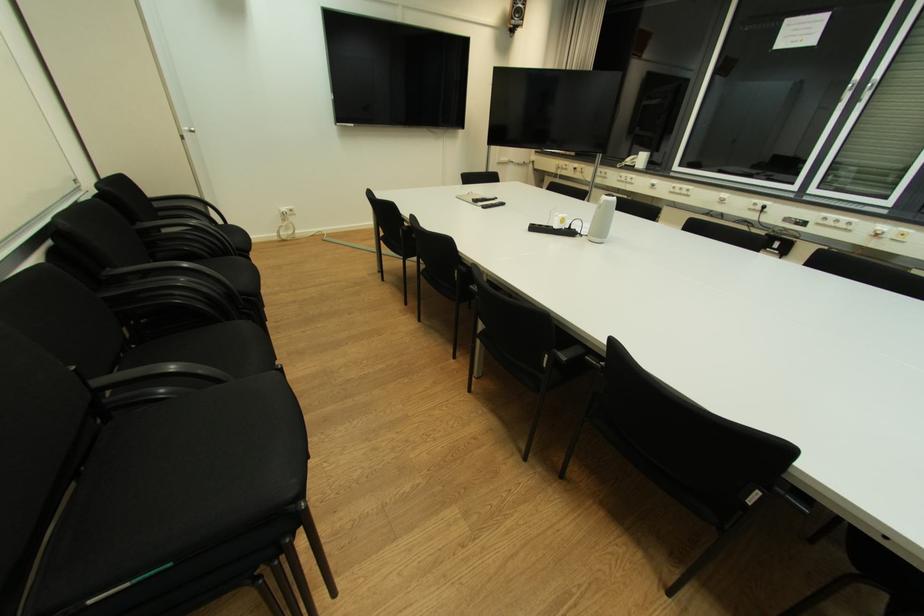
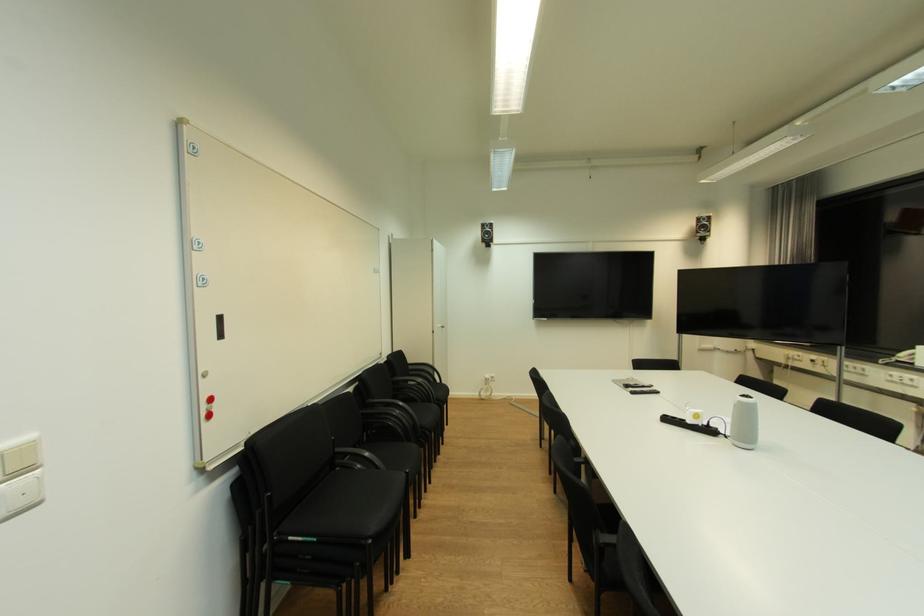
Locate, in the second image, the point that corresponds to point (540, 229) in the first image.

(674, 421)